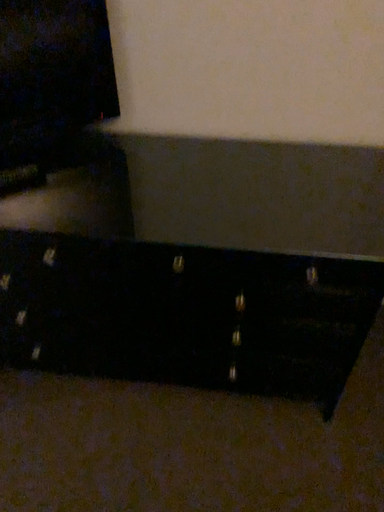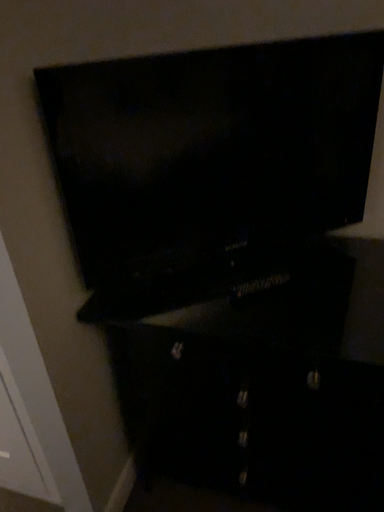
Question: Which way did the camera rotate in the video?

Choices:
 (A) rotated upward
 (B) rotated downward

Answer: (A)